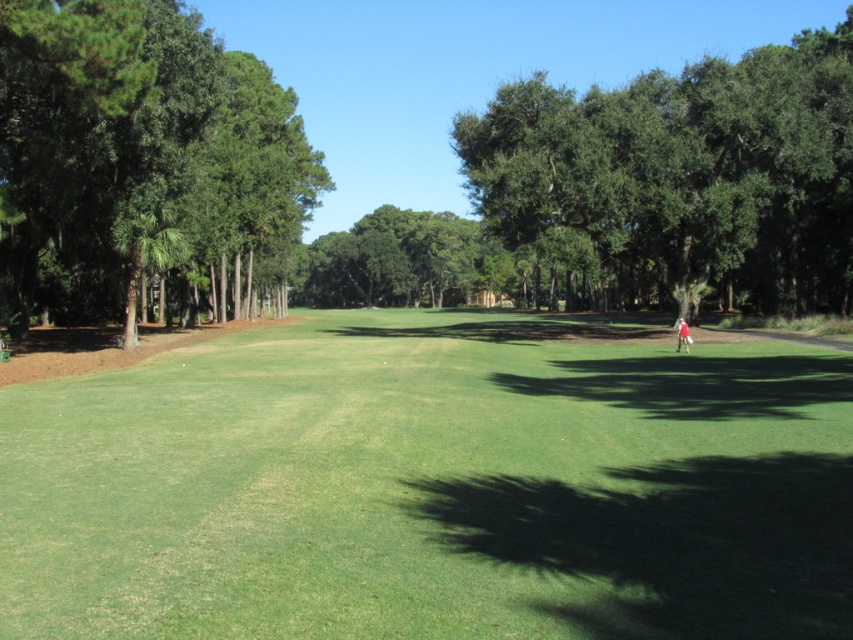
How far apart are green leafy tree at right and green leafy tree at center?

green leafy tree at right is 47.50 meters from green leafy tree at center.

Identify the location of green leafy tree at right. tap(682, 177).

Who is more distant from viewer, (740,221) or (345,244)?

The point (345,244) is more distant.

The image size is (853, 640). I want to click on green leafy tree at right, so click(x=682, y=177).

Is green grass at center in front of red fabric golfer at center?

Yes, green grass at center is closer to the viewer.

Is green grass at center below red fabric golfer at center?

Indeed, green grass at center is positioned under red fabric golfer at center.

Between point (141, 580) and point (685, 330), which one is positioned behind?

The point (685, 330) is behind.

Locate an element on the screen. green grass at center is located at coordinates (433, 486).

Who is more distant from viewer, (459, 548) or (845, 131)?

Positioned behind is point (845, 131).

Does green grass at center have a greater height compared to green leafy tree at right?

No, green grass at center is not taller than green leafy tree at right.

Which is in front, point (375, 557) or point (474, 172)?

Point (375, 557)

Locate an element on the screen. green grass at center is located at coordinates (433, 486).